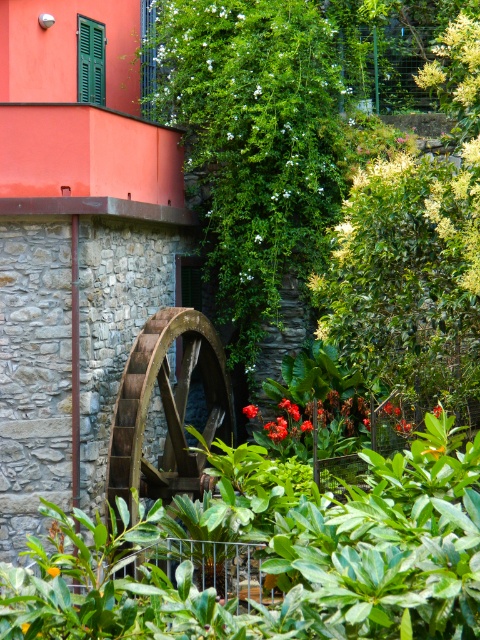
Question: Can you confirm if green matte shutter at upper left is wider than vivid red petals at center?

Choices:
 (A) no
 (B) yes

Answer: (B)

Question: Which object is the farthest from the brown wooden wheel at center?

Choices:
 (A) green matte shutter at upper left
 (B) white matte flower at center
 (C) vivid red petals at center

Answer: (A)

Question: Which is nearer to the green matte shutter at upper left?

Choices:
 (A) white matte flower at center
 (B) brown wooden wheel at center
 (C) orange matte flower at center
 (D) vivid red petals at center

Answer: (A)

Question: Is brown wooden wheel at center above orange matte flower at center?

Choices:
 (A) no
 (B) yes

Answer: (B)

Question: Does green matte shutter at upper left appear under vivid red petals at center?

Choices:
 (A) no
 (B) yes

Answer: (A)

Question: Estimate the real-world distances between objects in this image. Which object is closer to the orange matte flower at center?

Choices:
 (A) green matte shutter at upper left
 (B) brown wooden wheel at center
 (C) vivid red petals at center
 (D) white matte flower at center

Answer: (B)